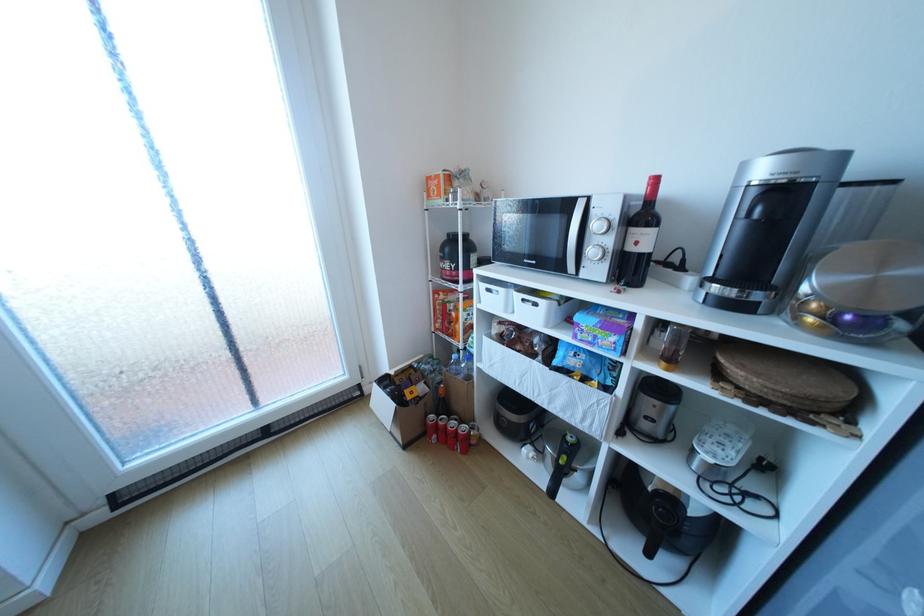
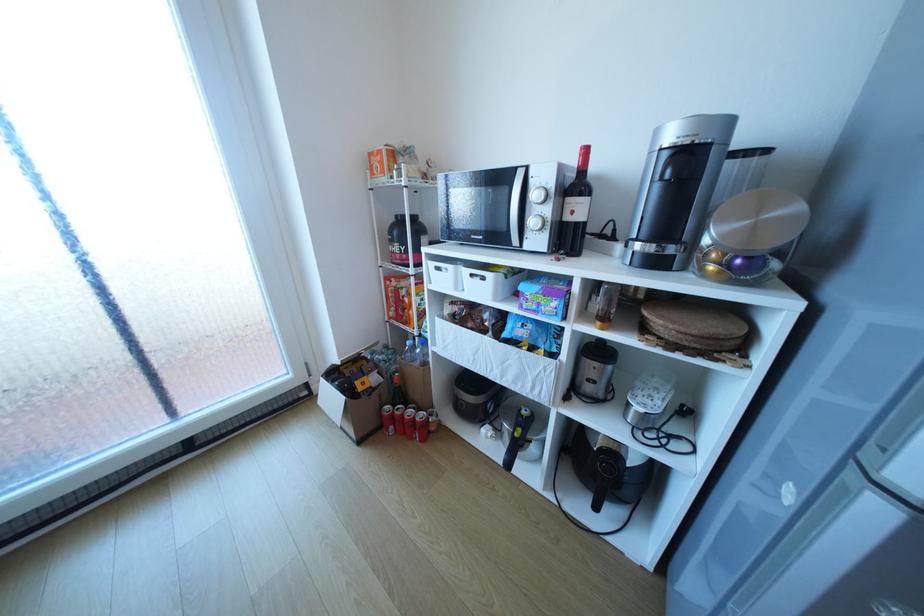
In the second image, find the point that corresponds to (x=446, y=363) in the first image.

(402, 354)